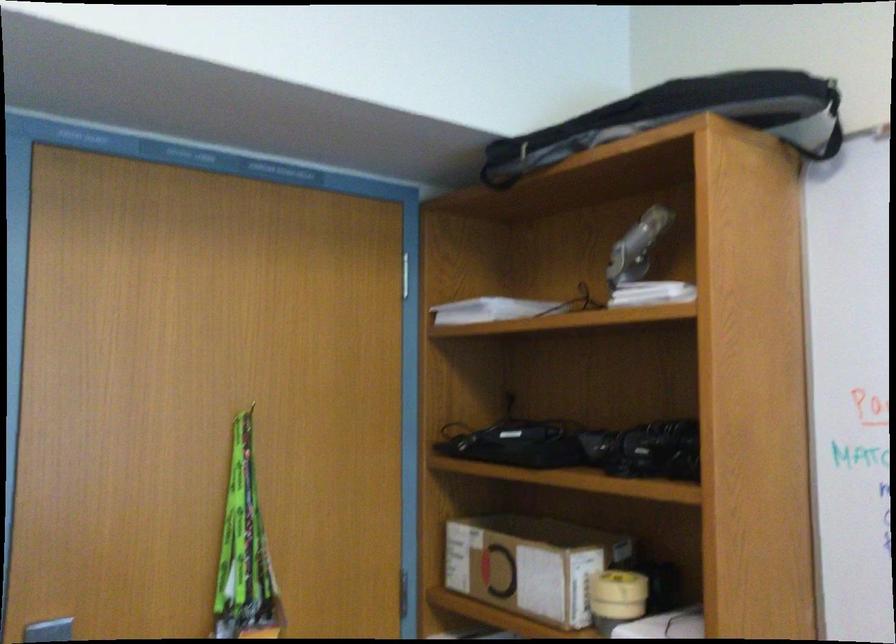
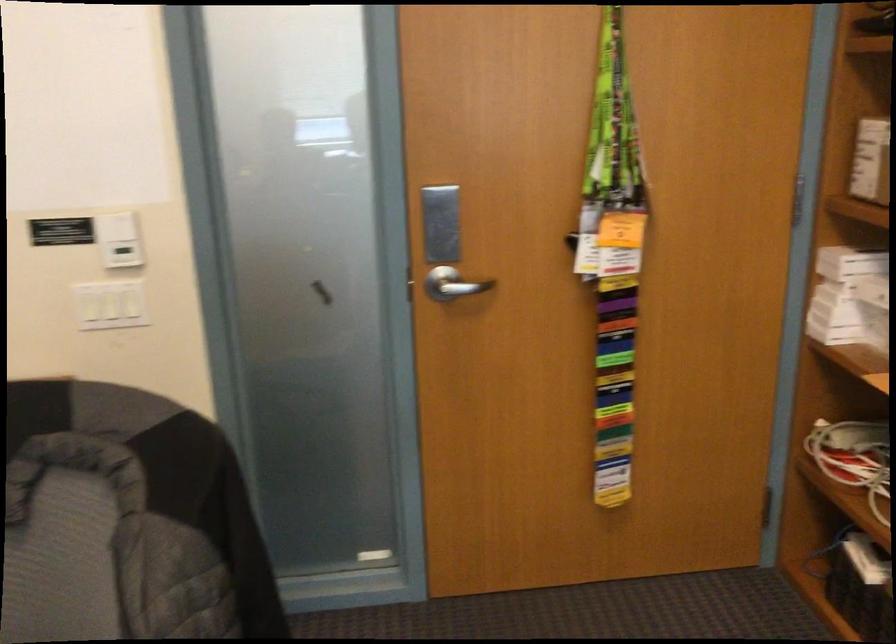
First-person continuous shooting, in which direction is the camera rotating?

The camera's rotation is toward left-down.